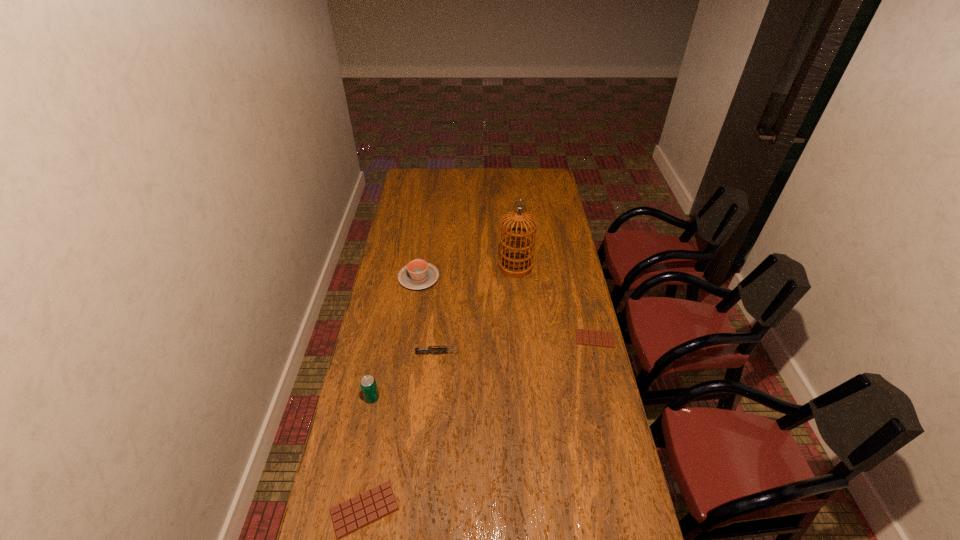
Locate an element on the screen. This screenshot has width=960, height=540. vacant space located 0.250m aimed along the barrel of the gun is located at coordinates (524, 354).

I want to click on free region located 0.380m on the handle side of the third tallest object, so [x=428, y=217].

This screenshot has height=540, width=960. Identify the location of free spot located on the handle side of the third tallest object. (424, 239).

This screenshot has width=960, height=540. I want to click on vacant area situated 0.170m on the handle side of the third tallest object, so click(424, 242).

You are a GUI agent. You are given a task and a screenshot of the screen. Output one action in this format:
    pyautogui.click(x=<x>, y=<y>)
    Task: Click on the vacant space located on the front of the birdcage
    The image size is (960, 540).
    Given the screenshot: What is the action you would take?
    pyautogui.click(x=517, y=289)

At what (x,y) coordinates should I click in order to perform the action: click on vacant point located 0.250m on the front of the second tallest object. Please return your answer as a coordinate pair (x, y). Image resolution: width=960 pixels, height=540 pixels. Looking at the image, I should click on (356, 476).

Find the location of a particular element. chinaware present at the left edge is located at coordinates (418, 274).

The height and width of the screenshot is (540, 960). In order to click on beer can situated at the left edge in this screenshot , I will do `click(368, 384)`.

Find the location of a particular element. The height and width of the screenshot is (540, 960). object at the right edge is located at coordinates (583, 337).

In the image, there is a desktop. Where is `free space at the far edge`? The image size is (960, 540). free space at the far edge is located at coordinates (512, 173).